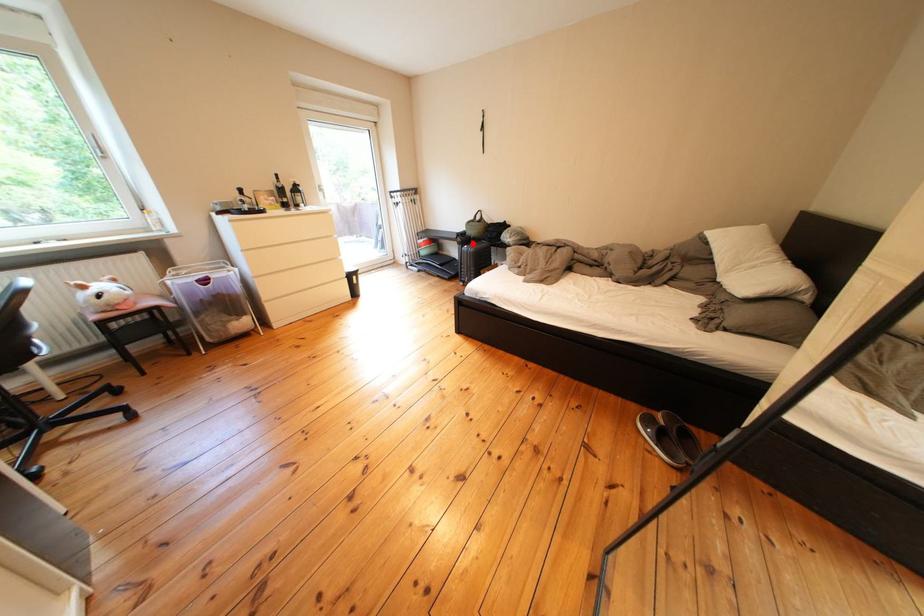
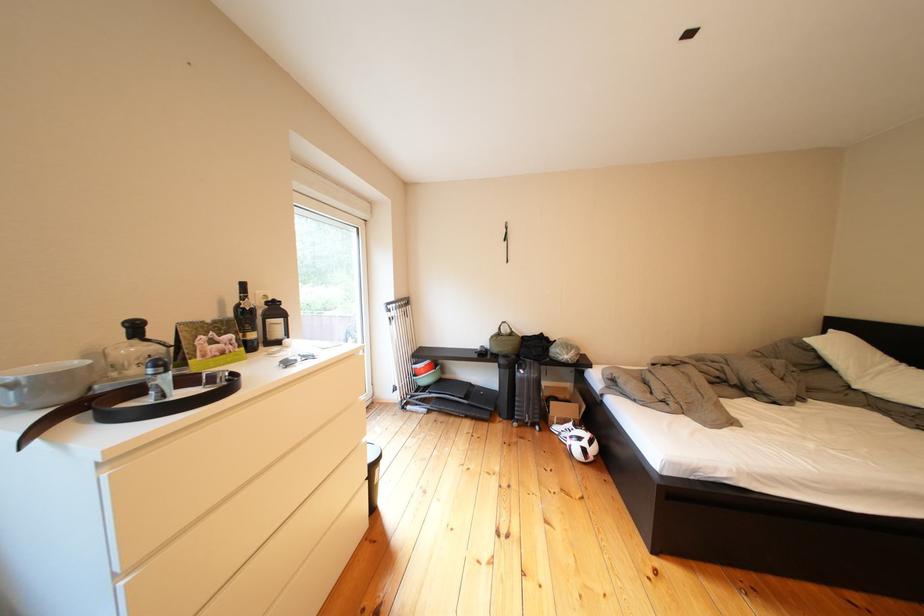
Find the pixel in the second image that matches the highlighted location in the first image.

(516, 366)